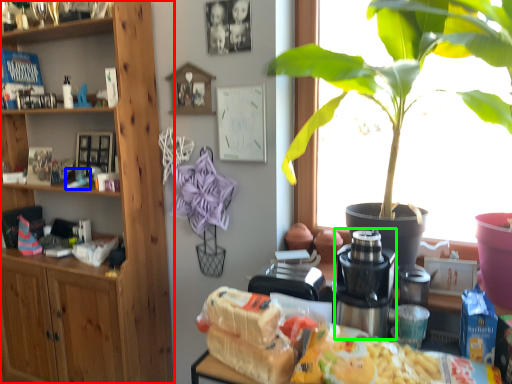
Question: Considering the real-world distances, which object is farthest from cabinetry (highlighted by a red box)? toy (highlighted by a blue box) or coffee machine (highlighted by a green box)?

Choices:
 (A) toy
 (B) coffee machine

Answer: (B)